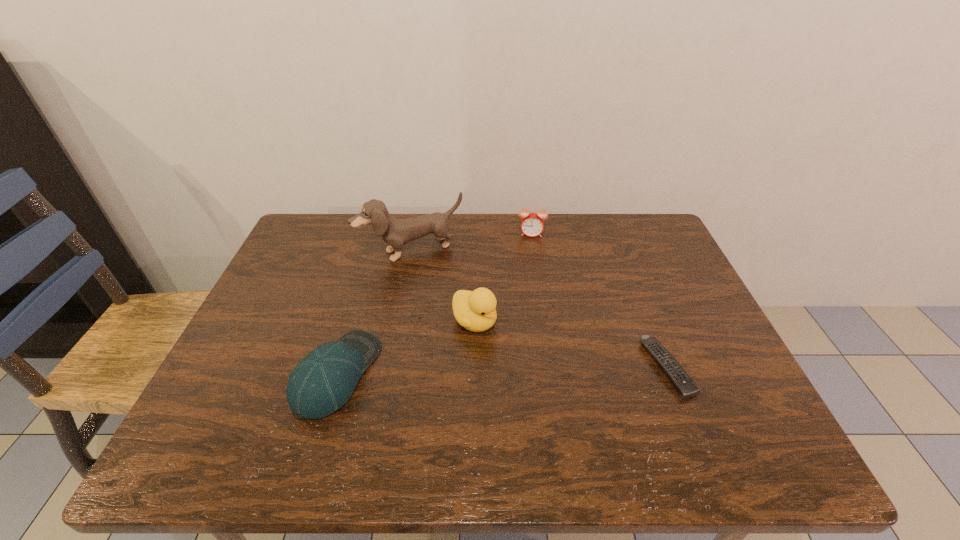
Locate which object ranks fourth in proximity to the puppy. Please provide its 2D coordinates. Your answer should be formatted as a tuple, i.e. [(x, y)], where the tuple contains the x and y coordinates of a point satisfying the conditions above.

[(685, 386)]

Where is `the third closest object to the second object from right to left`? the third closest object to the second object from right to left is located at coordinates click(685, 386).

This screenshot has width=960, height=540. In order to click on free space that satisfies the following two spatial constraints: 1. on the front side of the shortest object; 2. on the left side of the tallest object in this screenshot , I will do `click(390, 367)`.